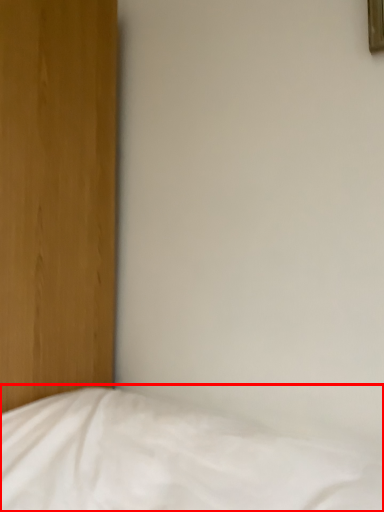
Question: From the image's perspective, what is the correct spatial relationship of bed (annotated by the red box) in relation to picture frame?

Choices:
 (A) below
 (B) above

Answer: (A)